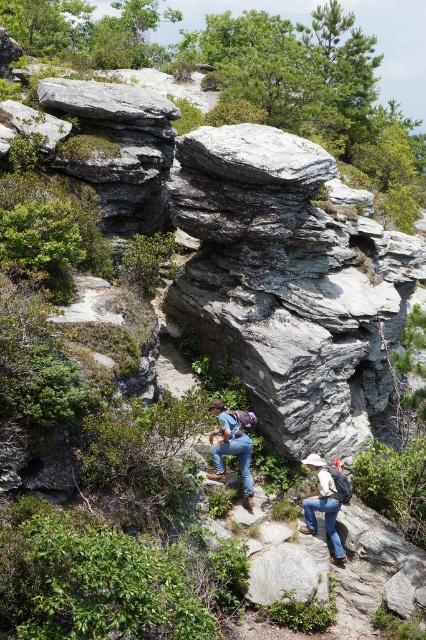
Is gray rough rock at upper center smaller than gray rough rock at center?

Actually, gray rough rock at upper center might be larger than gray rough rock at center.

Does gray rough rock at upper center have a greater height compared to gray rough rock at center?

Correct, gray rough rock at upper center is much taller as gray rough rock at center.

You are a GUI agent. You are given a task and a screenshot of the screen. Output one action in this format:
    pyautogui.click(x=<x>, y=<y>)
    Task: Click on the gray rough rock at upper center
    
    Given the screenshot: What is the action you would take?
    pyautogui.click(x=256, y=156)

Which is in front, point (158, 100) or point (319, 568)?

Positioned in front is point (319, 568).

Is gray rock at upper center taller than gray rough rock at center?

Yes.

This screenshot has width=426, height=640. I want to click on gray rock at upper center, so click(x=106, y=100).

Between gray rock at upper center and denim jeans at center, which one is positioned lower?

Positioned lower is denim jeans at center.

Does point (152, 122) come farther from viewer compared to point (328, 532)?

Yes, point (152, 122) is behind point (328, 532).

Does point (138, 116) come closer to viewer compared to point (322, 486)?

No.

At what (x,y) coordinates should I click in order to perform the action: click on gray rock at upper center. Please return your answer as a coordinate pair (x, y). This screenshot has height=640, width=426. Looking at the image, I should click on (106, 100).